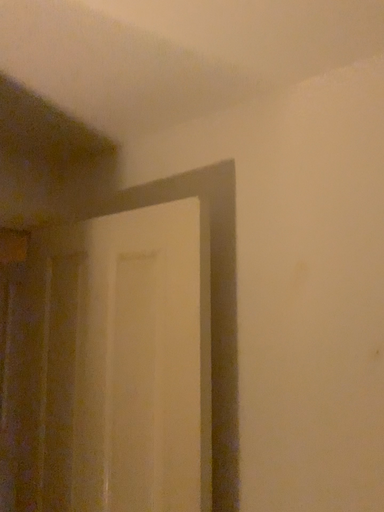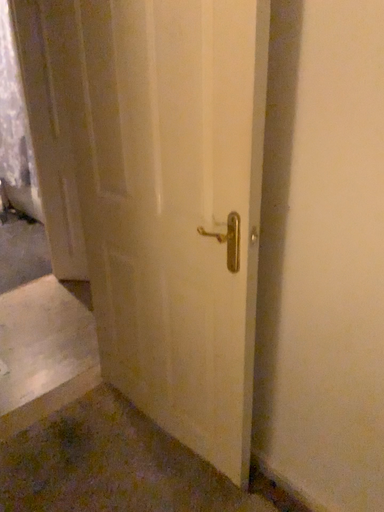
Question: How did the camera likely rotate when shooting the video?

Choices:
 (A) rotated downward
 (B) rotated upward

Answer: (A)